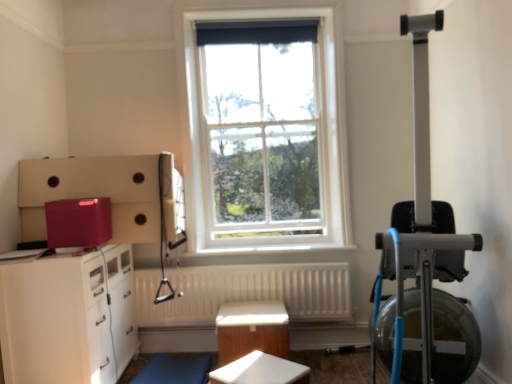
Locate an element on the screen. Image resolution: width=512 pixels, height=384 pixels. blank space situated above white textured radiator at center (from a real-world perspective) is located at coordinates (237, 264).